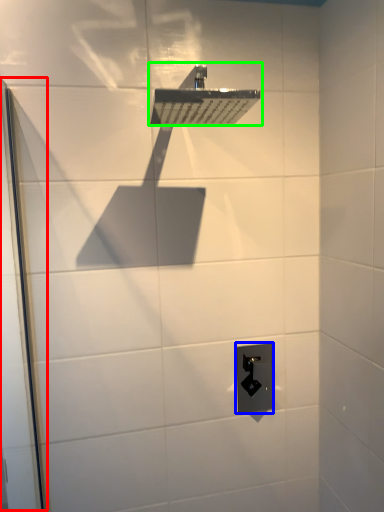
Question: Estimate the real-world distances between objects in this image. Which object is closer to screen door (highlighted by a red box), electric outlet (highlighted by a blue box) or shower (highlighted by a green box)?

Choices:
 (A) electric outlet
 (B) shower

Answer: (B)